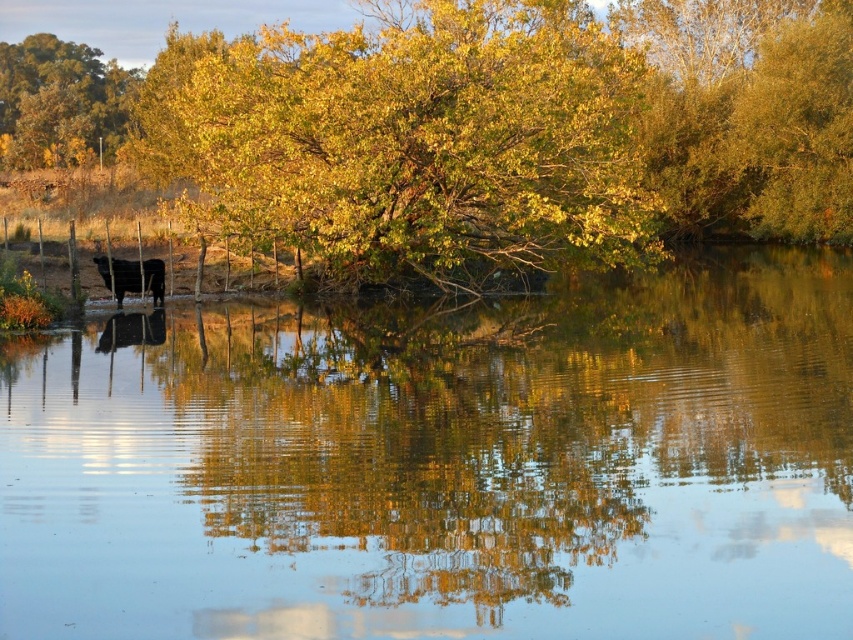
Question: Which of the following is the farthest from the observer?

Choices:
 (A) golden leafy tree at center
 (B) golden leafy tree at upper left
 (C) black glossy cow at left
 (D) clear water at center

Answer: (B)

Question: Does clear water at center lie behind golden leafy tree at upper left?

Choices:
 (A) no
 (B) yes

Answer: (A)

Question: Which of the following is the farthest from the observer?

Choices:
 (A) golden leafy tree at upper left
 (B) clear water at center
 (C) golden leafy tree at center
 (D) black glossy cow at left

Answer: (A)

Question: Is golden leafy tree at center thinner than black glossy cow at left?

Choices:
 (A) yes
 (B) no

Answer: (B)

Question: Which of these objects is positioned closest to the black glossy cow at left?

Choices:
 (A) golden leafy tree at upper left
 (B) golden leafy tree at center

Answer: (B)

Question: Can you confirm if clear water at center is smaller than golden leafy tree at upper left?

Choices:
 (A) yes
 (B) no

Answer: (A)